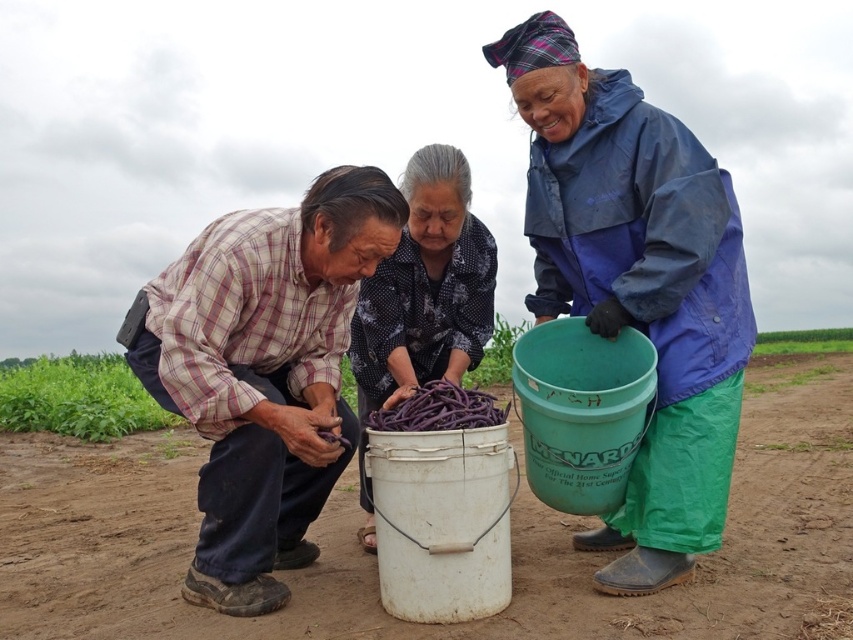
Question: Which object is closer to the camera taking this photo?

Choices:
 (A) matte white bucket at center
 (B) dirt field at lower center
 (C) patterned fabric bucket at center

Answer: (B)

Question: Based on their relative distances, which object is nearer to the plaid shirt at center?

Choices:
 (A) matte white bucket at center
 (B) dirt field at lower center

Answer: (A)

Question: Is the position of matte white bucket at center less distant than that of blue waterproof jacket at upper right?

Choices:
 (A) yes
 (B) no

Answer: (A)

Question: Can you confirm if blue waterproof jacket at upper right is positioned to the left of patterned fabric bucket at center?

Choices:
 (A) no
 (B) yes

Answer: (A)

Question: Which point is farther from the camera taking this photo?

Choices:
 (A) (488, 296)
 (B) (170, 328)
 (C) (705, 364)
 (D) (755, 440)

Answer: (D)

Question: Is dirt field at lower center to the left of plaid shirt at center from the viewer's perspective?

Choices:
 (A) no
 (B) yes

Answer: (A)